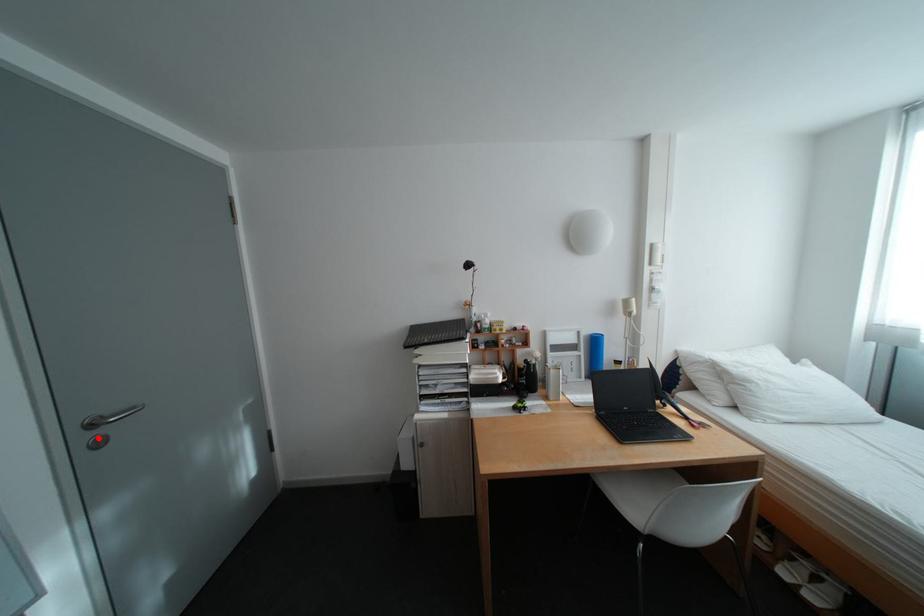
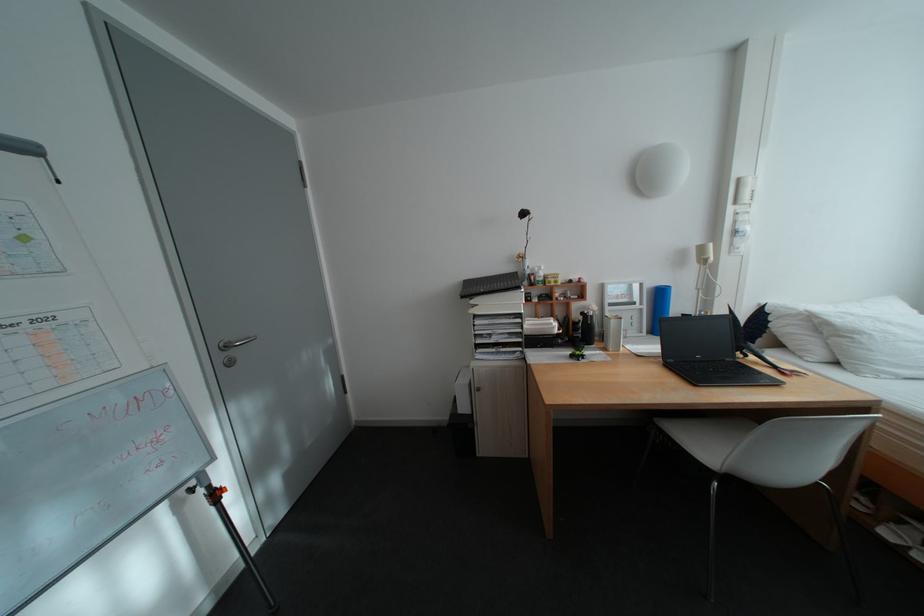
In the second image, find the point that corresponds to the highlighted location in the first image.

(234, 358)